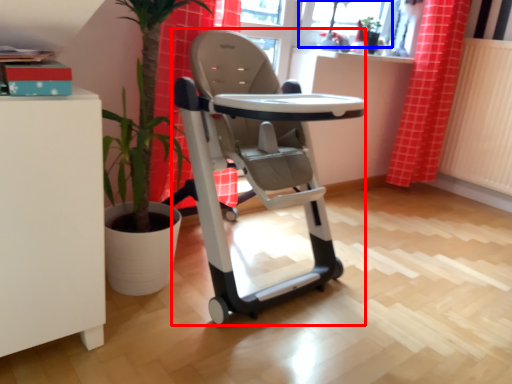
Question: Which object appears closest to the camera in this image, baby carriage (highlighted by a red box) or window screen (highlighted by a blue box)?

Choices:
 (A) baby carriage
 (B) window screen

Answer: (A)